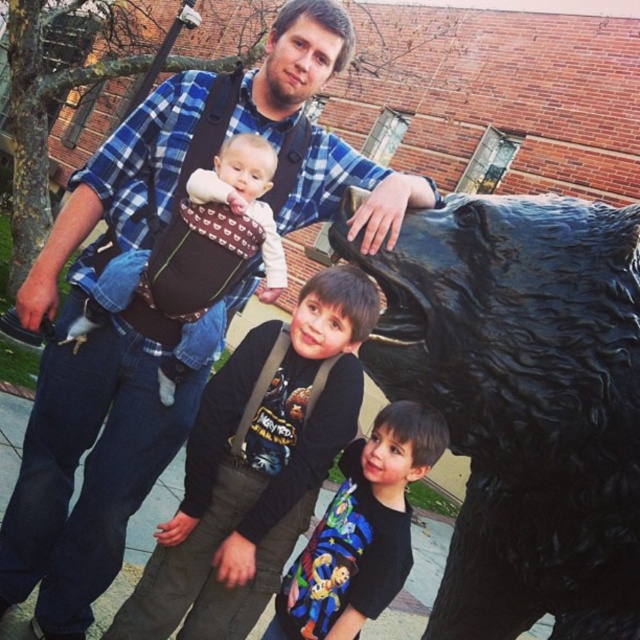
Does black glossy bear at right lie behind blue plaid shirt at upper center?

No, it is not.

Can you confirm if black glossy bear at right is smaller than blue plaid shirt at upper center?

Yes, black glossy bear at right is smaller than blue plaid shirt at upper center.

Between point (436, 332) and point (72, 403), which one is positioned in front?

Point (436, 332) is more forward.

At what (x,y) coordinates should I click in order to perform the action: click on black glossy bear at right. Please return your answer as a coordinate pair (x, y). Looking at the image, I should click on (522, 401).

Which of these two, blue plaid shirt at upper center or black t-shirt at center, stands shorter?

black t-shirt at center

This screenshot has height=640, width=640. Describe the element at coordinates (86, 474) in the screenshot. I see `blue plaid shirt at upper center` at that location.

Between point (320, 157) and point (353, 509), which one is positioned in front?

Point (353, 509)

Find the location of a particular element. This screenshot has height=640, width=640. blue plaid shirt at upper center is located at coordinates (x=86, y=474).

Measure the distance between blue plaid shirt at upper center and camera.

The distance of blue plaid shirt at upper center from camera is 3.05 meters.

From the picture: Who is more forward, (266, 97) or (307, 374)?

Positioned in front is point (307, 374).

Where is `blue plaid shirt at upper center`? Image resolution: width=640 pixels, height=640 pixels. blue plaid shirt at upper center is located at coordinates (86, 474).